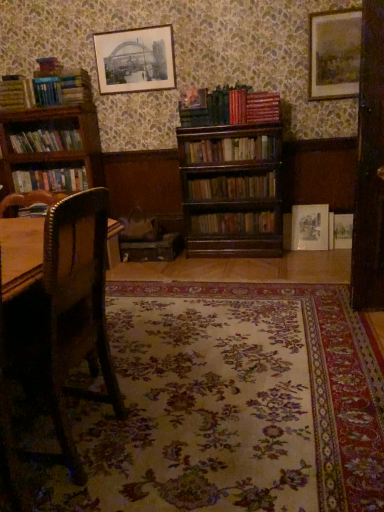
Where is `empty space that is ontop of matte paper picture frame at upper center, which is the 3th picture frame in bottom-to-top order (from a real-world perspective)`? This screenshot has height=512, width=384. empty space that is ontop of matte paper picture frame at upper center, which is the 3th picture frame in bottom-to-top order (from a real-world perspective) is located at coordinates (137, 26).